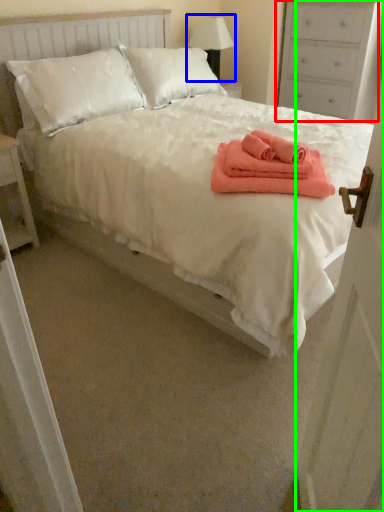
Question: Which object is positioned closest to dresser (highlighted by a red box)? Select from table lamp (highlighted by a blue box) and door (highlighted by a green box).

Choices:
 (A) table lamp
 (B) door

Answer: (A)